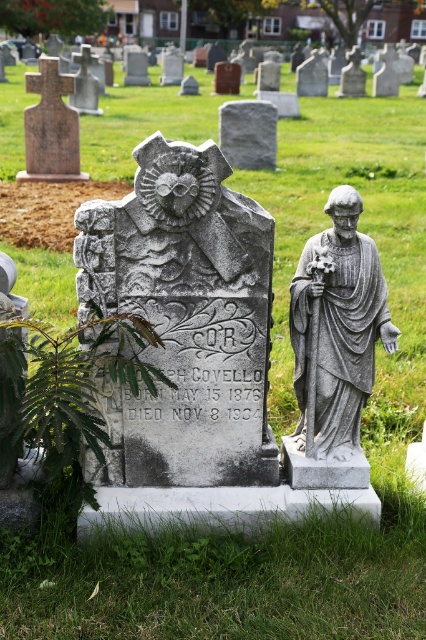
Does gray stone owl at center have a lesser height compared to gray stone gravestone at center?

Incorrect, gray stone owl at center's height does not fall short of gray stone gravestone at center's.

Is gray stone owl at center below gray stone gravestone at center?

Yes, gray stone owl at center is below gray stone gravestone at center.

Where is `gray stone owl at center`? This screenshot has height=640, width=426. gray stone owl at center is located at coordinates (186, 317).

Does gray stone statue at right have a larger size compared to gray stone gravestone at center?

Incorrect, gray stone statue at right is not larger than gray stone gravestone at center.

Does gray stone statue at right have a lesser height compared to gray stone gravestone at center?

No.

Does point (353, 308) come behind point (233, 148)?

That is False.

You are a GUI agent. You are given a task and a screenshot of the screen. Output one action in this format:
    pyautogui.click(x=<x>, y=<y>)
    Task: Click on the gray stone statue at right
    
    Given the screenshot: What is the action you would take?
    pyautogui.click(x=339, y=326)

Does gray stone owl at center have a smaller size compared to gray stone statue at right?

Incorrect, gray stone owl at center is not smaller in size than gray stone statue at right.

Find the location of a particular element. This screenshot has width=426, height=640. gray stone owl at center is located at coordinates (186, 317).

This screenshot has height=640, width=426. What are the coordinates of `gray stone owl at center` in the screenshot? It's located at (186, 317).

This screenshot has height=640, width=426. Find the location of `gray stone owl at center`. gray stone owl at center is located at coordinates (186, 317).